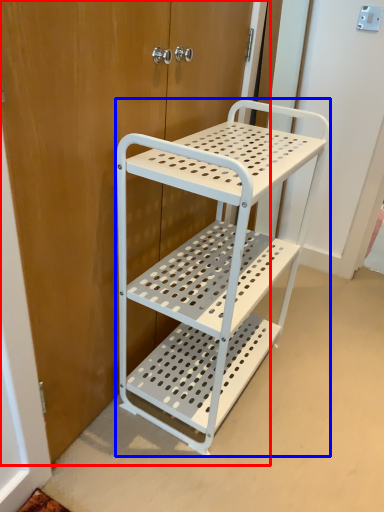
Question: Among these objects, which one is farthest to the camera, door (highlighted by a red box) or furniture (highlighted by a blue box)?

Choices:
 (A) door
 (B) furniture

Answer: (B)